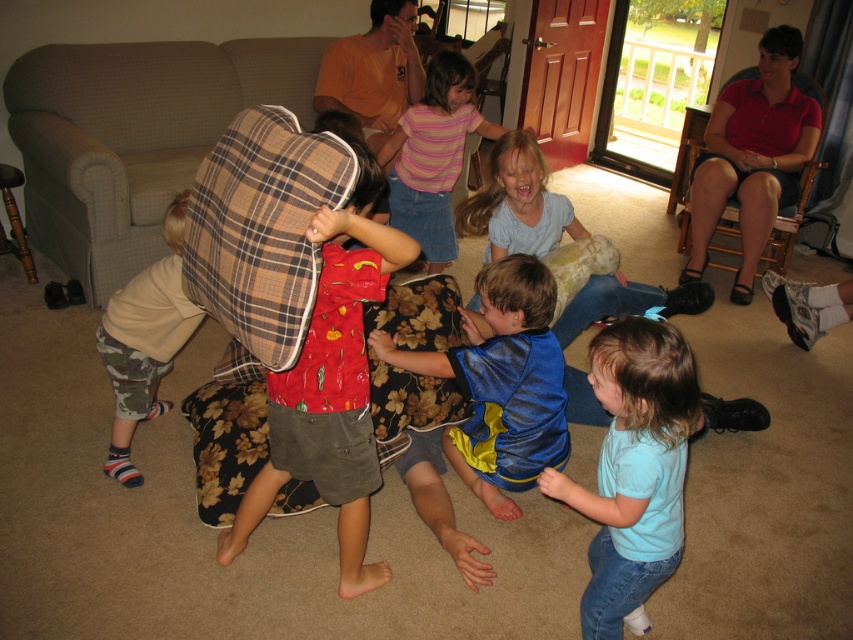
You are standing in the living room and want to reach a point that is exactly 2.39 meters away from you. Can you confirm if the point at coordinates (554, 449) is exactly that distance away?

Yes, the point at coordinates (554, 449) is exactly 2.39 meters from the viewer, so you can reach it by moving directly towards that point.

You are a parent trying to fit two children into a small elevator. The blue shiny shirt at center and the striped cotton shirt at center are the two kids. The elevator can only hold two children side by side. Can both children fit in the elevator if they stand next to each other?

The blue shiny shirt at center might be wider than striped cotton shirt at center, so there is uncertainty about whether both can fit in the elevator side by side. The parent should check the total width of both children before deciding.